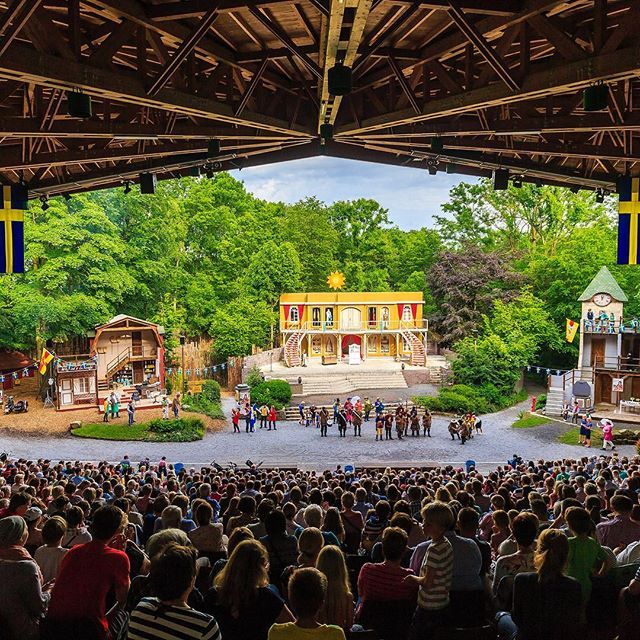
The height and width of the screenshot is (640, 640). What are the coordinates of `stage` in the screenshot? It's located at (355, 436).